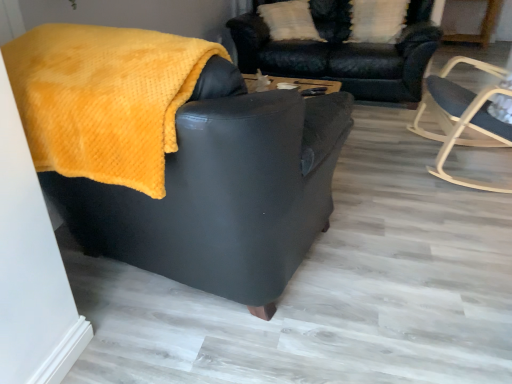
Question: Considering the relative positions of light wood rocking chair at right, acting as the 1th chair starting from the right, and velvet black couch at upper center in the image provided, is light wood rocking chair at right, acting as the 1th chair starting from the right, to the left of velvet black couch at upper center from the viewer's perspective?

Choices:
 (A) yes
 (B) no

Answer: (B)

Question: Does light wood rocking chair at right, acting as the 1th chair starting from the right, have a smaller size compared to velvet black couch at upper center?

Choices:
 (A) yes
 (B) no

Answer: (A)

Question: Does light wood rocking chair at right, acting as the 1th chair starting from the right, have a lesser height compared to velvet black couch at upper center?

Choices:
 (A) yes
 (B) no

Answer: (B)

Question: Can you confirm if light wood rocking chair at right, placed as the 2th chair when sorted from left to right, is taller than velvet black couch at upper center?

Choices:
 (A) no
 (B) yes

Answer: (B)

Question: Is light wood rocking chair at right, placed as the 2th chair when sorted from left to right, aimed at velvet black couch at upper center?

Choices:
 (A) yes
 (B) no

Answer: (B)

Question: From the image's perspective, is light wood rocking chair at right, placed as the 2th chair when sorted from left to right, on velvet black couch at upper center?

Choices:
 (A) yes
 (B) no

Answer: (B)

Question: Is velvet black couch at upper center outside of white textured pillow at upper center?

Choices:
 (A) no
 (B) yes

Answer: (B)

Question: From a real-world perspective, is velvet black couch at upper center on top of white textured pillow at upper center?

Choices:
 (A) yes
 (B) no

Answer: (B)

Question: Can you confirm if velvet black couch at upper center is thinner than white textured pillow at upper center?

Choices:
 (A) yes
 (B) no

Answer: (B)

Question: Considering the relative sizes of velvet black couch at upper center and white textured pillow at upper center in the image provided, is velvet black couch at upper center taller than white textured pillow at upper center?

Choices:
 (A) no
 (B) yes

Answer: (B)

Question: From a real-world perspective, is velvet black couch at upper center positioned under white textured pillow at upper center based on gravity?

Choices:
 (A) no
 (B) yes

Answer: (B)

Question: Is velvet black couch at upper center bigger than white textured pillow at upper center?

Choices:
 (A) yes
 (B) no

Answer: (A)

Question: From a real-world perspective, is white textured pillow at upper center physically above matte black armchair at center, which is counted as the second chair, starting from the right?

Choices:
 (A) yes
 (B) no

Answer: (A)